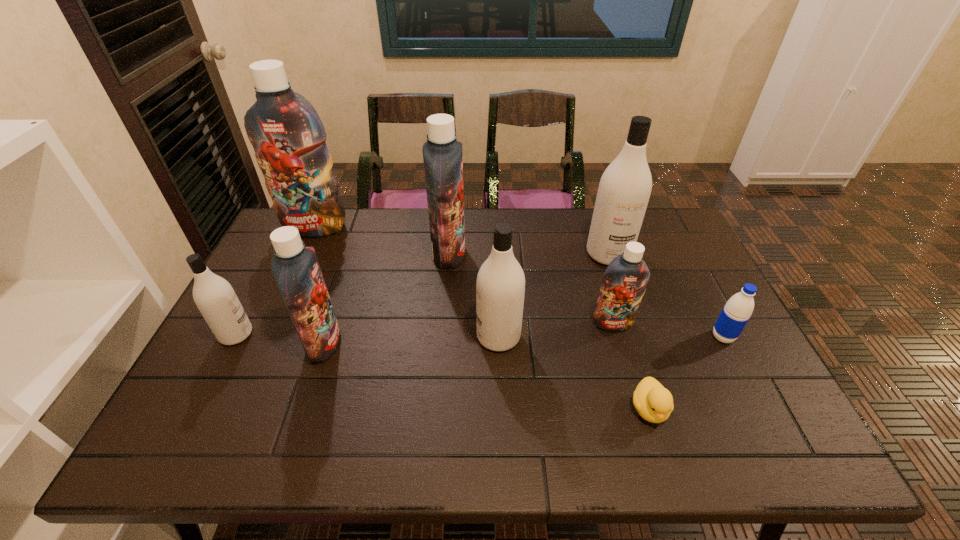
Locate an element on the screen. free spot located on the front-facing side of the second biggest white shampoo is located at coordinates (446, 336).

The height and width of the screenshot is (540, 960). Identify the location of blank space located 0.180m on the front-facing side of the second biggest white shampoo. (409, 336).

Image resolution: width=960 pixels, height=540 pixels. In order to click on free space located 0.120m on the front-facing side of the second biggest white shampoo in this screenshot , I will do `click(431, 336)`.

Where is `vacant space situated on the front-facing side of the leftmost white shampoo`? vacant space situated on the front-facing side of the leftmost white shampoo is located at coordinates tap(320, 334).

Locate an element on the screen. This screenshot has width=960, height=540. free space located 0.160m on the front label of the smallest blue shampoo is located at coordinates (630, 383).

The width and height of the screenshot is (960, 540). Find the location of `free region located on the back of the rightmost object`. free region located on the back of the rightmost object is located at coordinates (700, 292).

This screenshot has height=540, width=960. What are the coordinates of `vacant point located on the front-facing side of the duck` in the screenshot? It's located at (664, 458).

Image resolution: width=960 pixels, height=540 pixels. In order to click on object situated at the near edge in this screenshot , I will do `click(654, 403)`.

This screenshot has width=960, height=540. I want to click on object that is at the right edge, so click(x=738, y=309).

Identify the location of object at the far left corner. pyautogui.click(x=289, y=139).